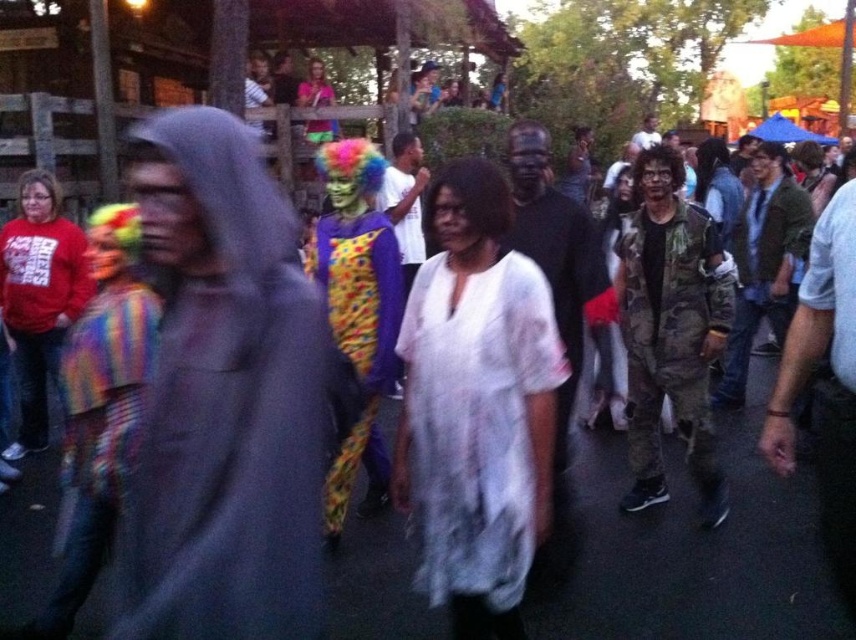
Question: Among these points, which one is farthest from the camera?

Choices:
 (A) (15, 236)
 (B) (360, 381)
 (C) (318, 72)

Answer: (C)

Question: Considering the relative positions of white sheer dress at center and matte pink shirt at upper center in the image provided, where is white sheer dress at center located with respect to matte pink shirt at upper center?

Choices:
 (A) right
 (B) left

Answer: (A)

Question: Is white sheer dress at center in front of matte pink shirt at upper center?

Choices:
 (A) yes
 (B) no

Answer: (A)

Question: Is the position of multicolored fabric clown at center less distant than that of matte red sweatshirt at left?

Choices:
 (A) yes
 (B) no

Answer: (A)

Question: Considering the real-world distances, which object is closest to the white sheer dress at center?

Choices:
 (A) matte red sweatshirt at left
 (B) matte pink shirt at upper center
 (C) multicolored fabric clown at center

Answer: (C)

Question: Which point is farther to the camera?

Choices:
 (A) (355, 241)
 (B) (313, 141)
 (C) (479, 508)

Answer: (B)